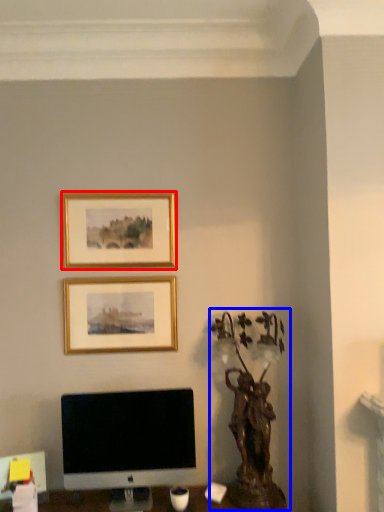
Question: Which point is further to the camera, picture frame (highlighted by a red box) or bronze statue (highlighted by a blue box)?

Choices:
 (A) picture frame
 (B) bronze statue

Answer: (A)